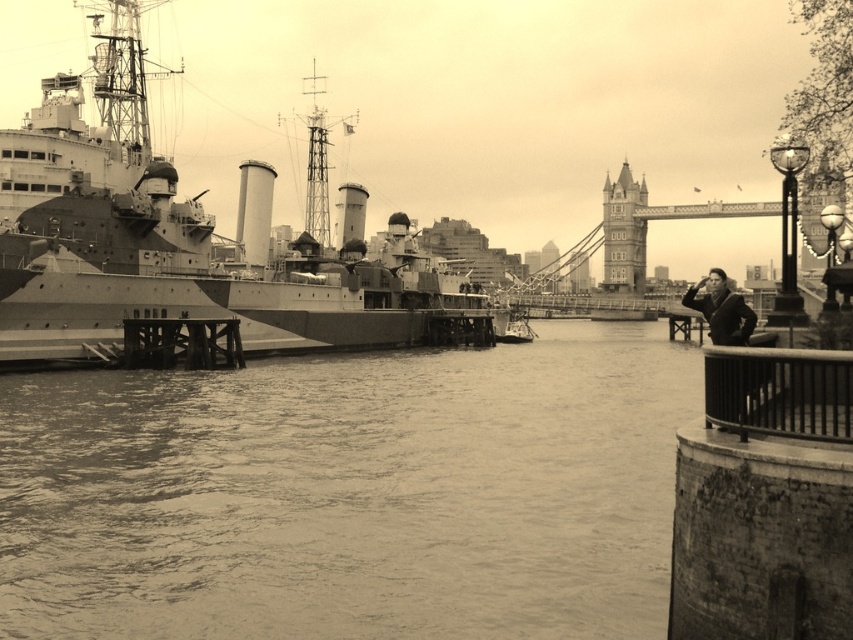
You are standing at the waterfront and see the rusty metal railing at lower right and the smooth black coat at lower right. Which object is smaller in size?

The rusty metal railing at lower right has a smaller size compared to the smooth black coat at lower right.

You are standing on the pier and see the rusty metal railing at lower right and the smooth black coat at lower right. Which object is taller?

The smooth black coat at lower right is taller than the rusty metal railing at lower right.

You are a photographer planning to take a portrait of a person wearing a smooth black coat at lower right near the matte gray ship at left. Given their height difference, will the ship tower over the person in the photo?

The matte gray ship at left is much taller than the smooth black coat at lower right, so yes, the ship will tower over the person in the photo.